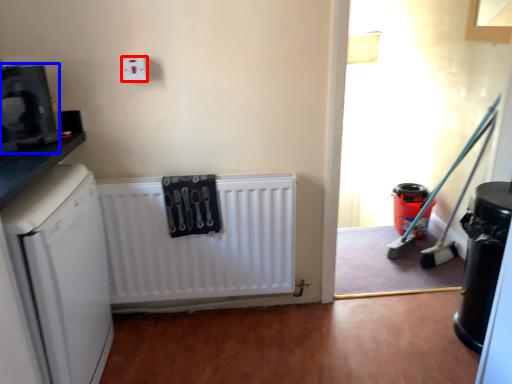
Question: Which of the following is the closest to the observer, electric outlet (highlighted by a red box) or appliance (highlighted by a blue box)?

Choices:
 (A) electric outlet
 (B) appliance

Answer: (B)